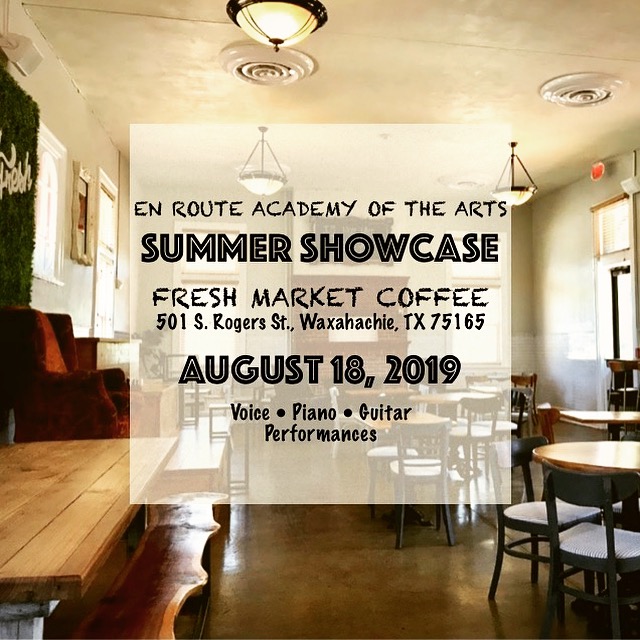
Locate an element on the screen. chair is located at coordinates (104, 384).